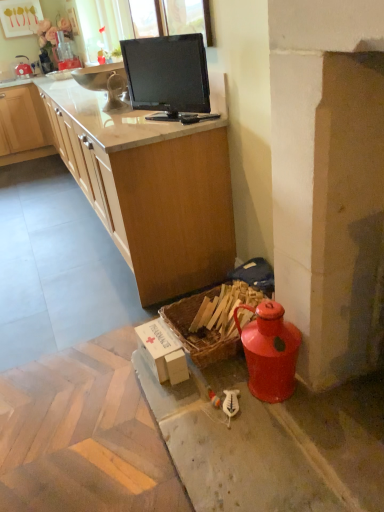
Question: Should I look upward or downward to see white cardboard box at lower center?

Choices:
 (A) down
 (B) up

Answer: (A)

Question: Is woven wood picnic basket at lower right directly adjacent to matte wood countertop at upper center?

Choices:
 (A) yes
 (B) no

Answer: (B)

Question: Considering the relative sizes of woven wood picnic basket at lower right and matte wood countertop at upper center in the image provided, is woven wood picnic basket at lower right smaller than matte wood countertop at upper center?

Choices:
 (A) no
 (B) yes

Answer: (B)

Question: Is woven wood picnic basket at lower right outside matte wood countertop at upper center?

Choices:
 (A) no
 (B) yes

Answer: (B)

Question: Does woven wood picnic basket at lower right have a larger size compared to matte wood countertop at upper center?

Choices:
 (A) yes
 (B) no

Answer: (B)

Question: Considering the relative sizes of woven wood picnic basket at lower right and matte wood countertop at upper center in the image provided, is woven wood picnic basket at lower right thinner than matte wood countertop at upper center?

Choices:
 (A) yes
 (B) no

Answer: (A)

Question: Considering the relative sizes of woven wood picnic basket at lower right and matte wood countertop at upper center in the image provided, is woven wood picnic basket at lower right taller than matte wood countertop at upper center?

Choices:
 (A) yes
 (B) no

Answer: (B)

Question: From the image's perspective, would you say woven wood picnic basket at lower right is shown under black glossy monitor at upper center?

Choices:
 (A) no
 (B) yes

Answer: (B)

Question: Can we say woven wood picnic basket at lower right lies outside black glossy monitor at upper center?

Choices:
 (A) yes
 (B) no

Answer: (A)

Question: Does woven wood picnic basket at lower right have a larger size compared to black glossy monitor at upper center?

Choices:
 (A) no
 (B) yes

Answer: (B)

Question: From a real-world perspective, is woven wood picnic basket at lower right located beneath black glossy monitor at upper center?

Choices:
 (A) yes
 (B) no

Answer: (A)

Question: Considering the relative sizes of woven wood picnic basket at lower right and black glossy monitor at upper center in the image provided, is woven wood picnic basket at lower right taller than black glossy monitor at upper center?

Choices:
 (A) no
 (B) yes

Answer: (A)

Question: Is woven wood picnic basket at lower right far from black glossy monitor at upper center?

Choices:
 (A) no
 (B) yes

Answer: (B)

Question: Is matte wood countertop at upper center oriented towards white cardboard box at lower center?

Choices:
 (A) yes
 (B) no

Answer: (B)